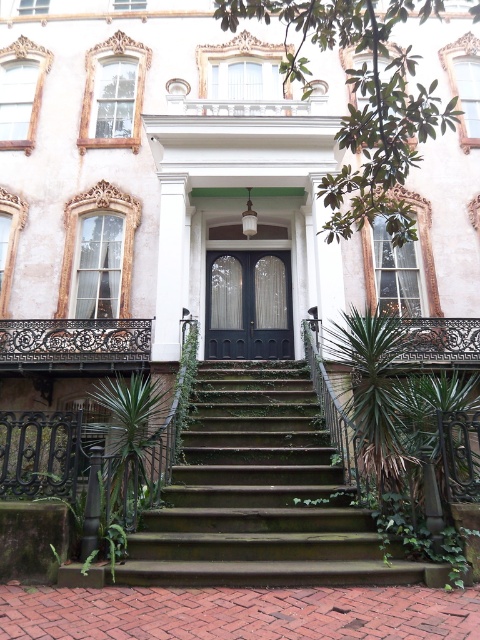
Is green leafy plant at lower left to the left of black wrought iron balustrade at center from the viewer's perspective?

No, green leafy plant at lower left is not to the left of black wrought iron balustrade at center.

Can you confirm if green leafy plant at lower left is positioned above black wrought iron balustrade at center?

Incorrect, green leafy plant at lower left is not positioned above black wrought iron balustrade at center.

Describe the element at coordinates (135, 444) in the screenshot. The image size is (480, 640). I see `green leafy plant at lower left` at that location.

Locate an element on the screen. green leafy plant at lower left is located at coordinates coord(135,444).

Can you confirm if green mossy stairs at center is positioned to the right of black matte door at center?

Yes, green mossy stairs at center is to the right of black matte door at center.

Between green mossy stairs at center and black matte door at center, which one is positioned lower?

green mossy stairs at center is lower down.

Describe the element at coordinates (260, 493) in the screenshot. I see `green mossy stairs at center` at that location.

Image resolution: width=480 pixels, height=640 pixels. I want to click on green mossy stairs at center, so click(x=260, y=493).

Who is more distant from viewer, (x=254, y=337) or (x=170, y=406)?

The point (x=254, y=337) is more distant.

Does black matte door at center appear under green ivy at center?

Incorrect, black matte door at center is not positioned below green ivy at center.

This screenshot has height=640, width=480. I want to click on black matte door at center, so click(x=249, y=305).